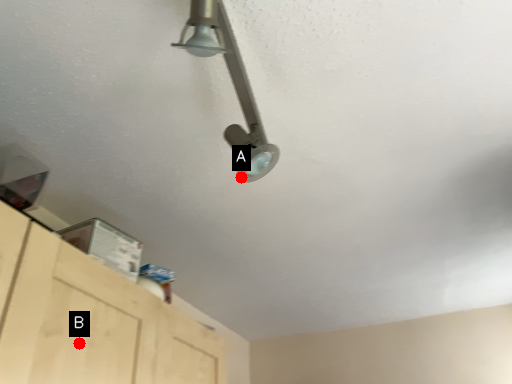
Question: Two points are circled on the image, labeled by A and B beside each circle. Which point appears closest to the camera in this image?

Choices:
 (A) A is closer
 (B) B is closer

Answer: (B)